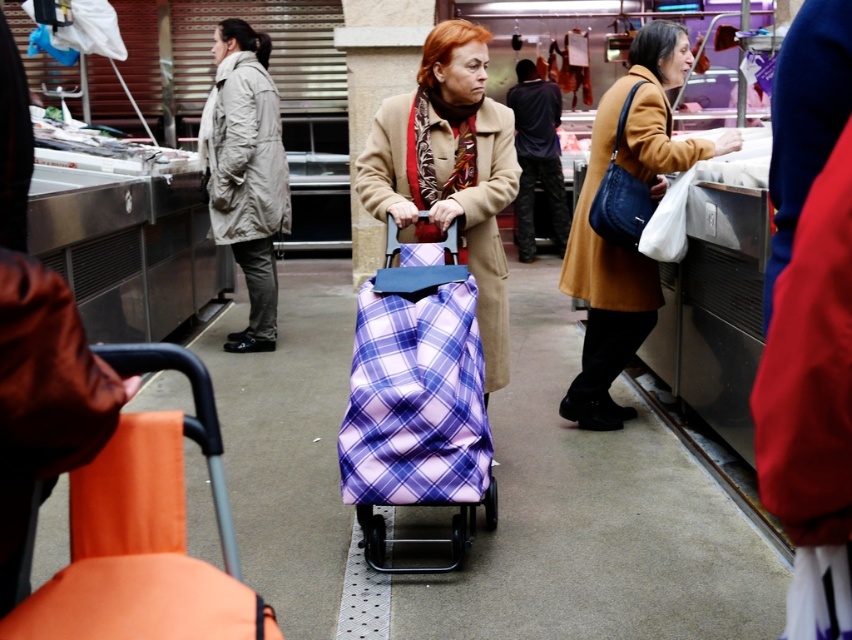
You are a shopper in the market and want to grab your plaid fabric bag at center and brown wool coat at center. Which one is closer to your left side?

The plaid fabric bag at center is to the left of brown wool coat at center, so the plaid fabric bag at center is closer to your left side.

You are a customer at the market and want to reach the matte blue leather bag at right without disturbing the brown wool coat at center. Is there a way to do this?

The brown wool coat at center is positioned under the matte blue leather bag at right, so you can reach the matte blue leather bag at right by moving around the brown wool coat at center since it is below the bag.

You are a delivery person who needs to place a small package in either the brown wool coat at center or the matte blue leather bag at right. Which one is more likely to have enough space for the package?

The brown wool coat at center has a larger size compared to matte blue leather bag at right, so it is more likely to have enough space for the package.